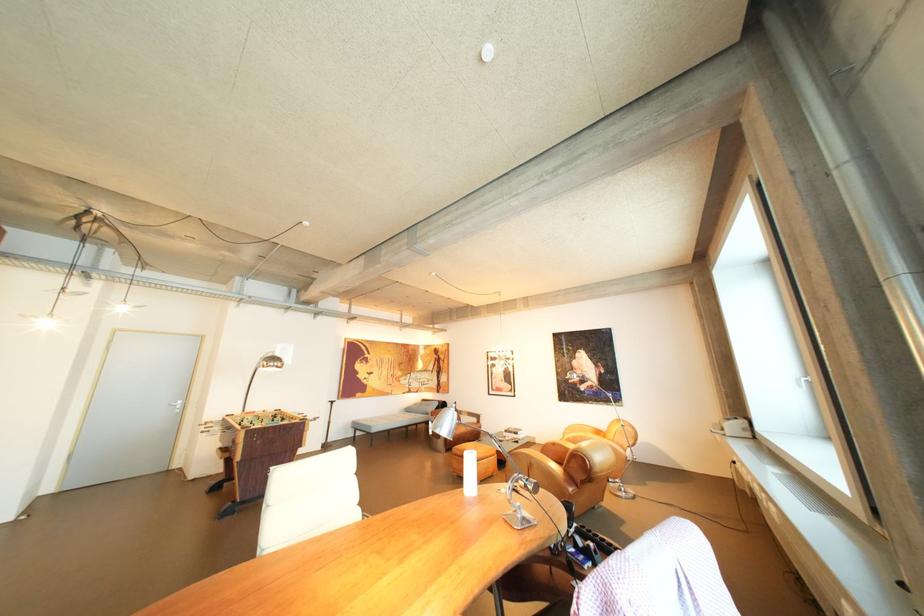
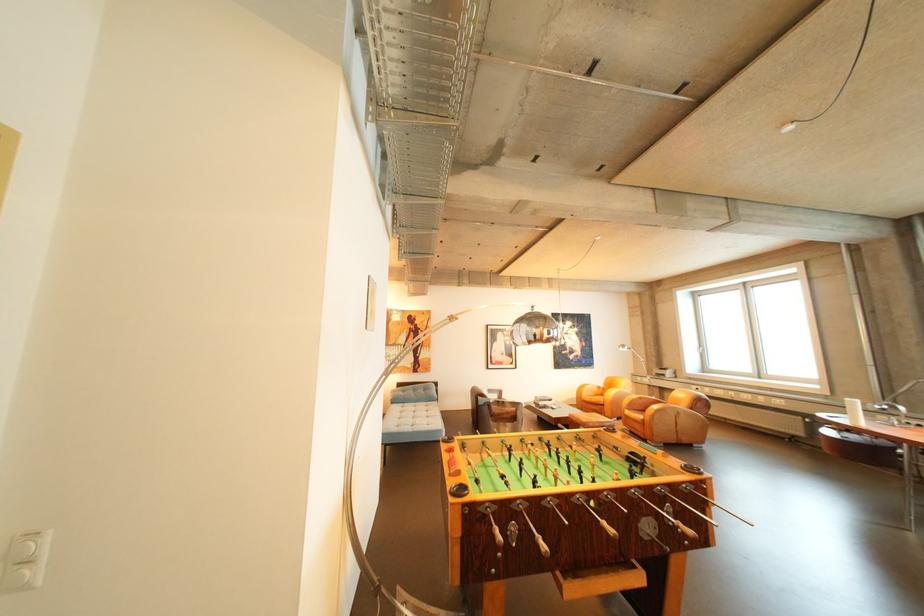
In the second image, find the point that corresponds to [584,428] in the first image.

(594, 387)